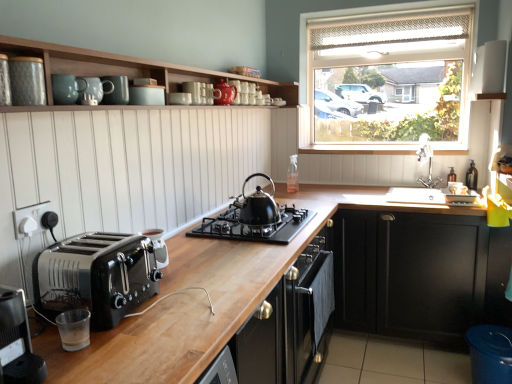
Question: From a real-world perspective, is matte white bowl at upper center, which ranks as the 3th appliance in right-to-left order, on top of black metallic toaster at lower left, marked as the 4th appliance in a front-to-back arrangement?

Choices:
 (A) no
 (B) yes

Answer: (B)

Question: Does matte white bowl at upper center, arranged as the 6th appliance when ordered from the bottom, appear on the right side of black metallic toaster at lower left, the fourth appliance in the right-to-left sequence?

Choices:
 (A) yes
 (B) no

Answer: (A)

Question: Is matte white bowl at upper center, which is the 3th appliance from top to bottom, further to camera compared to black metallic toaster at lower left, the first appliance when ordered from bottom to top?

Choices:
 (A) yes
 (B) no

Answer: (A)

Question: Is matte white bowl at upper center, which is the 3th appliance from top to bottom, bigger than black metallic toaster at lower left, which is the fifth appliance in back-to-front order?

Choices:
 (A) yes
 (B) no

Answer: (B)

Question: From the image's perspective, is matte white bowl at upper center, arranged as the third appliance when viewed from the back, located above black metallic toaster at lower left, the first appliance when ordered from bottom to top?

Choices:
 (A) no
 (B) yes

Answer: (B)

Question: Is matte white bowl at upper center, which ranks as the 3th appliance in right-to-left order, located outside black metallic toaster at lower left, which is the fifth appliance in back-to-front order?

Choices:
 (A) no
 (B) yes

Answer: (B)

Question: Is wooden at upper center to the right of silver metallic faucet at upper right from the viewer's perspective?

Choices:
 (A) no
 (B) yes

Answer: (A)

Question: From a real-world perspective, is wooden at upper center positioned under silver metallic faucet at upper right based on gravity?

Choices:
 (A) no
 (B) yes

Answer: (A)

Question: Considering the relative sizes of wooden at upper center and silver metallic faucet at upper right in the image provided, is wooden at upper center bigger than silver metallic faucet at upper right?

Choices:
 (A) no
 (B) yes

Answer: (B)

Question: Is wooden at upper center oriented towards silver metallic faucet at upper right?

Choices:
 (A) yes
 (B) no

Answer: (B)

Question: Is wooden at upper center behind silver metallic faucet at upper right?

Choices:
 (A) no
 (B) yes

Answer: (B)

Question: Is wooden at upper center shorter than silver metallic faucet at upper right?

Choices:
 (A) no
 (B) yes

Answer: (B)

Question: Is the depth of black matte cabinet at lower right, which ranks as the second cabinetry in left-to-right order, greater than that of matte ceramic mugs at upper center, positioned as the 1th cabinetry in left-to-right order?

Choices:
 (A) yes
 (B) no

Answer: (A)